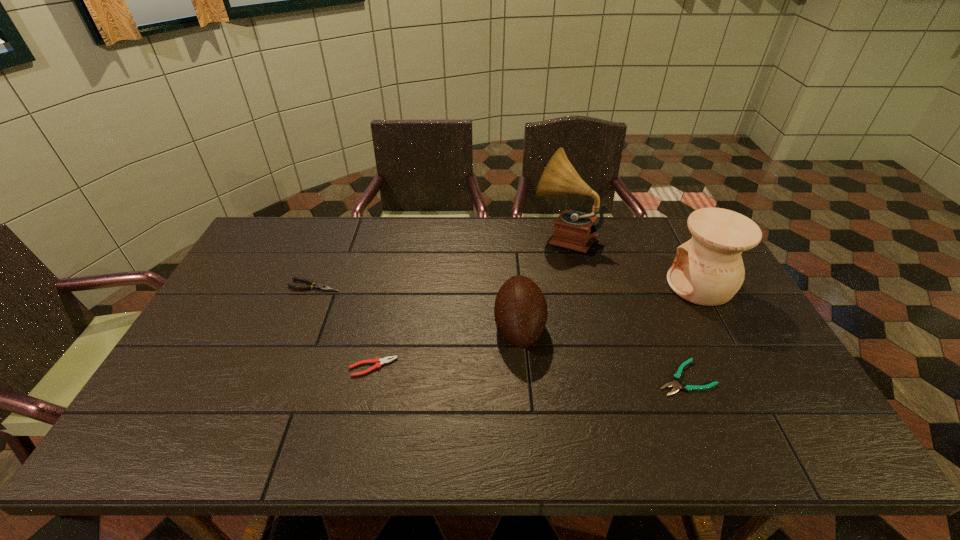
Locate an element on the screen. This screenshot has height=540, width=960. object that stands as the fourth closest to the second shortest object is located at coordinates (676, 377).

Point out which object is positioned as the fifth nearest to the tallest object. Please provide its 2D coordinates. Your answer should be formatted as a tuple, i.e. [(x, y)], where the tuple contains the x and y coordinates of a point satisfying the conditions above.

[(323, 287)]

Identify which pliers is the second nearest to the leftmost pliers. Please provide its 2D coordinates. Your answer should be formatted as a tuple, i.e. [(x, y)], where the tuple contains the x and y coordinates of a point satisfying the conditions above.

[(676, 377)]

You are a GUI agent. You are given a task and a screenshot of the screen. Output one action in this format:
    pyautogui.click(x=<x>, y=<y>)
    Task: Click on the second closest pliers to the pottery
    Image resolution: width=960 pixels, height=540 pixels.
    Given the screenshot: What is the action you would take?
    pyautogui.click(x=378, y=362)

You are a GUI agent. You are given a task and a screenshot of the screen. Output one action in this format:
    pyautogui.click(x=<x>, y=<y>)
    Task: Click on the vacant point that satisfies the following two spatial constraints: 1. on the back side of the shortest object; 2. on the laces of the football
    The width and height of the screenshot is (960, 540).
    Given the screenshot: What is the action you would take?
    pyautogui.click(x=664, y=328)

Locate an element on the screen. This screenshot has height=540, width=960. vacant region that satisfies the following two spatial constraints: 1. on the laces of the football; 2. on the back side of the shortest object is located at coordinates (523, 377).

Where is `free spot that satisfies the following two spatial constraints: 1. on the horn of the phonograph record; 2. on the right side of the rightmost pliers`? The image size is (960, 540). free spot that satisfies the following two spatial constraints: 1. on the horn of the phonograph record; 2. on the right side of the rightmost pliers is located at coordinates (596, 377).

Find the location of a particular element. Image resolution: width=960 pixels, height=540 pixels. vacant space that satisfies the following two spatial constraints: 1. on the horn of the farthest object; 2. on the right side of the shortest object is located at coordinates (596, 377).

In order to click on vacant area in the image that satisfies the following two spatial constraints: 1. on the laces of the football; 2. on the left side of the rightmost pliers in this screenshot , I will do `click(523, 377)`.

Where is `free region that satisfies the following two spatial constraints: 1. on the horn of the shortest pliers; 2. on the left side of the tallest object`? free region that satisfies the following two spatial constraints: 1. on the horn of the shortest pliers; 2. on the left side of the tallest object is located at coordinates (596, 377).